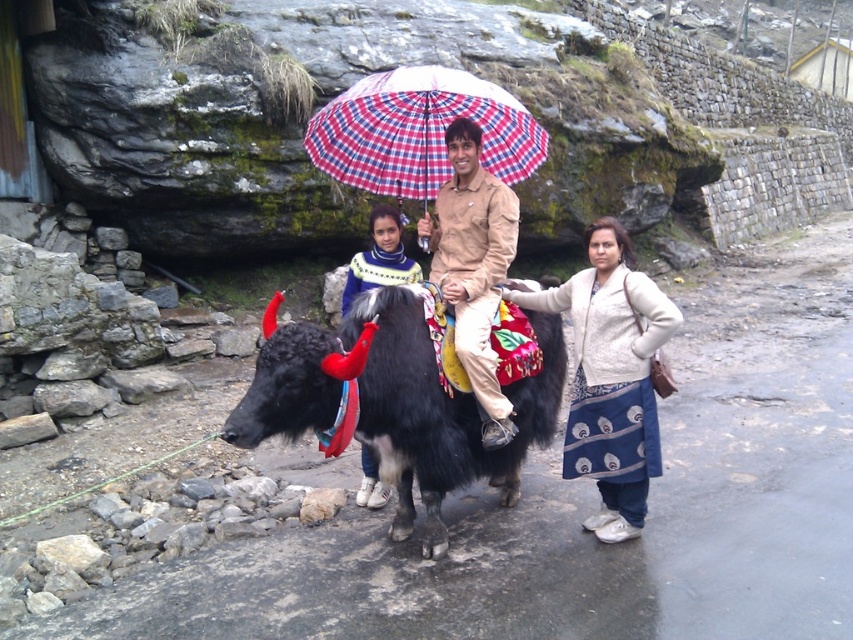
You are planning to take a photo of the blue printed dress at right and the plaid fabric umbrella at center. Which object should you focus on first if you want to capture both in the frame without moving the camera?

The blue printed dress at right is smaller than the plaid fabric umbrella at center, so you should focus on the plaid fabric umbrella at center first to ensure it fits properly in the frame.

You are a photographer trying to capture a photo of the beige cotton shirt at center and the plaid fabric umbrella at center. Based on their heights, which one should you focus on first if you want to frame them both in the same shot without adjusting your camera angle?

The plaid fabric umbrella at center is not as tall as the beige cotton shirt at center, so you should focus on the beige cotton shirt at center first to ensure it fits within the frame since it is taller.

You are planning to take a photo of the black fuzzy yak at center and the knitted sweater at center for a nature magazine. Which object should you focus on first if you want to capture the larger subject in the frame?

You should focus on the black fuzzy yak at center first because it is larger in size than the knitted sweater at center.